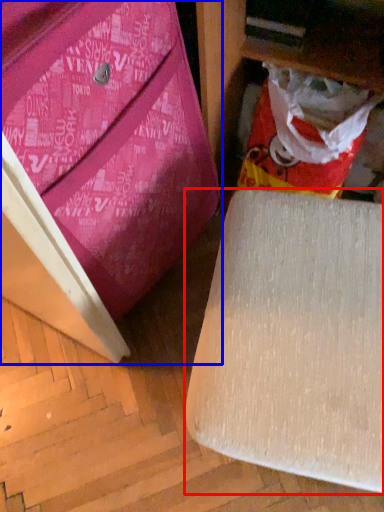
Question: Which point is closer to the camera, furniture (highlighted by a red box) or furniture (highlighted by a blue box)?

Choices:
 (A) furniture
 (B) furniture

Answer: (B)